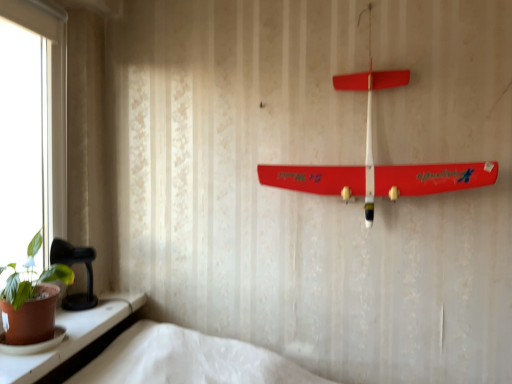
Question: Is matte white window sill at lower left not within green matte houseplant at lower left?

Choices:
 (A) yes
 (B) no

Answer: (A)

Question: Does matte white window sill at lower left lie in front of green matte houseplant at lower left?

Choices:
 (A) yes
 (B) no

Answer: (A)

Question: Is matte white window sill at lower left turned away from green matte houseplant at lower left?

Choices:
 (A) yes
 (B) no

Answer: (B)

Question: From a real-world perspective, is matte white window sill at lower left physically above green matte houseplant at lower left?

Choices:
 (A) no
 (B) yes

Answer: (A)

Question: Can you confirm if matte white window sill at lower left is shorter than green matte houseplant at lower left?

Choices:
 (A) no
 (B) yes

Answer: (B)

Question: Are matte white window sill at lower left and green matte houseplant at lower left located far from each other?

Choices:
 (A) yes
 (B) no

Answer: (B)

Question: Does smooth plastic airplane at upper center have a greater height compared to green matte houseplant at lower left?

Choices:
 (A) yes
 (B) no

Answer: (A)

Question: Would you say green matte houseplant at lower left is part of smooth plastic airplane at upper center's contents?

Choices:
 (A) yes
 (B) no

Answer: (B)

Question: Is there a large distance between smooth plastic airplane at upper center and green matte houseplant at lower left?

Choices:
 (A) yes
 (B) no

Answer: (A)

Question: Considering the relative positions of smooth plastic airplane at upper center and green matte houseplant at lower left in the image provided, is smooth plastic airplane at upper center in front of green matte houseplant at lower left?

Choices:
 (A) yes
 (B) no

Answer: (B)

Question: Can you confirm if smooth plastic airplane at upper center is positioned to the left of green matte houseplant at lower left?

Choices:
 (A) no
 (B) yes

Answer: (A)

Question: Is smooth plastic airplane at upper center located outside green matte houseplant at lower left?

Choices:
 (A) yes
 (B) no

Answer: (A)

Question: Does green matte houseplant at lower left come behind matte white window sill at lower left?

Choices:
 (A) yes
 (B) no

Answer: (A)